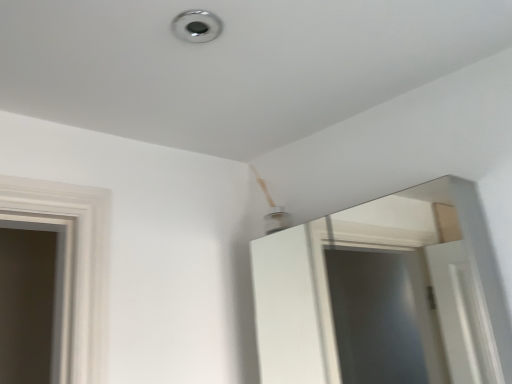
Question: Considering the positions of chrome metallic light at upper center and white glossy mirror at upper center in the image, is chrome metallic light at upper center wider or thinner than white glossy mirror at upper center?

Choices:
 (A) thin
 (B) wide

Answer: (A)

Question: From a real-world perspective, relative to white glossy mirror at upper center, is chrome metallic light at upper center vertically above or below?

Choices:
 (A) above
 (B) below

Answer: (A)

Question: Based on their positions, is chrome metallic light at upper center located to the left or right of white glossy mirror at upper center?

Choices:
 (A) right
 (B) left

Answer: (B)

Question: Is white glossy mirror at upper center bigger or smaller than chrome metallic light at upper center?

Choices:
 (A) big
 (B) small

Answer: (A)

Question: Is point (500, 380) positioned closer to the camera than point (196, 13)?

Choices:
 (A) farther
 (B) closer

Answer: (A)

Question: From the image's perspective, is white glossy mirror at upper center located above or below chrome metallic light at upper center?

Choices:
 (A) below
 (B) above

Answer: (A)

Question: Considering their positions, is white glossy mirror at upper center located in front of or behind chrome metallic light at upper center?

Choices:
 (A) behind
 (B) front

Answer: (B)